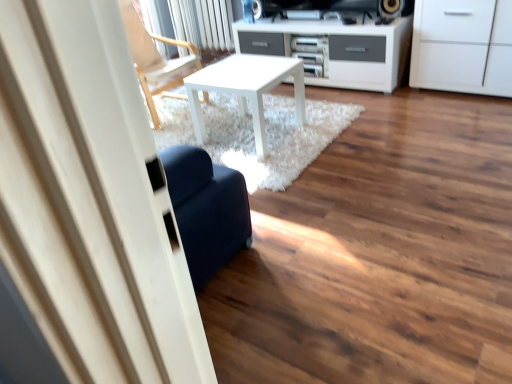
Question: Does white matte cabinet at upper right appear on the right side of wooden chair at upper left?

Choices:
 (A) yes
 (B) no

Answer: (A)

Question: Can you confirm if white matte cabinet at upper right is positioned to the left of wooden chair at upper left?

Choices:
 (A) no
 (B) yes

Answer: (A)

Question: Is white matte cabinet at upper right outside wooden chair at upper left?

Choices:
 (A) no
 (B) yes

Answer: (B)

Question: Is wooden chair at upper left surrounded by white matte cabinet at upper right?

Choices:
 (A) yes
 (B) no

Answer: (B)

Question: From a real-world perspective, is white matte cabinet at upper right located higher than wooden chair at upper left?

Choices:
 (A) no
 (B) yes

Answer: (A)

Question: From a real-world perspective, relative to white matte table at center, is wooden chair at upper left vertically above or below?

Choices:
 (A) above
 (B) below

Answer: (A)

Question: From the image's perspective, is wooden chair at upper left located above or below white matte table at center?

Choices:
 (A) below
 (B) above

Answer: (B)

Question: Relative to white matte table at center, is wooden chair at upper left in front or behind?

Choices:
 (A) front
 (B) behind

Answer: (B)

Question: In terms of width, does wooden chair at upper left look wider or thinner when compared to white matte table at center?

Choices:
 (A) thin
 (B) wide

Answer: (B)

Question: From their relative heights in the image, would you say white matte table at center is taller or shorter than wooden chair at upper left?

Choices:
 (A) tall
 (B) short

Answer: (B)

Question: From a real-world perspective, is white matte table at center physically located above or below wooden chair at upper left?

Choices:
 (A) below
 (B) above

Answer: (A)

Question: Which is correct: white matte table at center is inside wooden chair at upper left, or outside of it?

Choices:
 (A) outside
 (B) inside

Answer: (A)

Question: Looking at the image, does white matte table at center seem bigger or smaller compared to wooden chair at upper left?

Choices:
 (A) big
 (B) small

Answer: (B)

Question: Is white matte cabinet at upper right wider or thinner than white matte table at center?

Choices:
 (A) thin
 (B) wide

Answer: (A)

Question: Relative to white matte table at center, is white matte cabinet at upper right in front or behind?

Choices:
 (A) front
 (B) behind

Answer: (B)